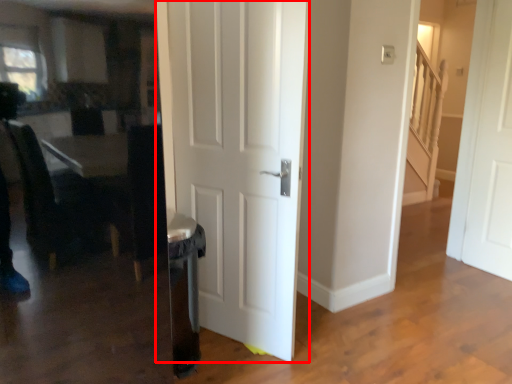
Question: From the image's perspective, what is the correct spatial relationship of door (annotated by the red box) in relation to door?

Choices:
 (A) below
 (B) above

Answer: (A)